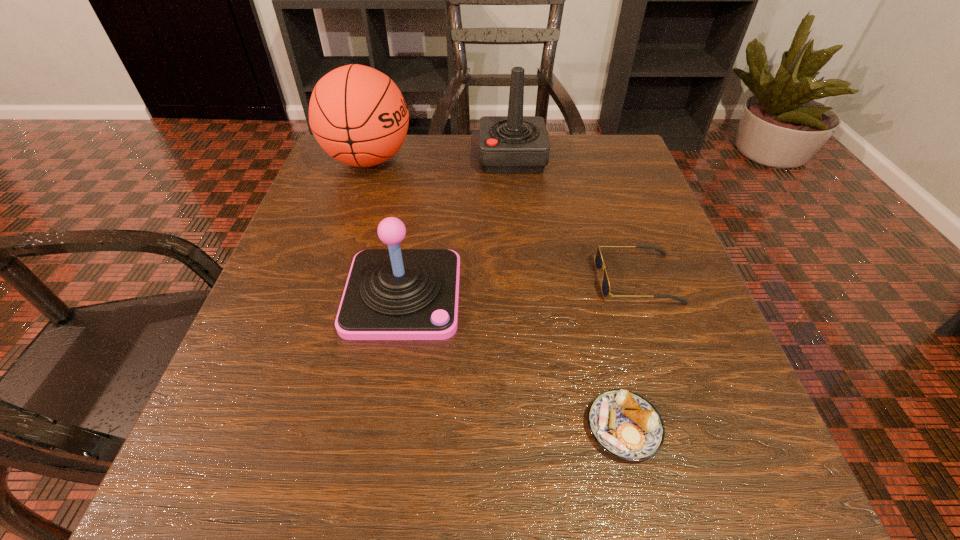
This screenshot has height=540, width=960. I want to click on free point between the second shortest object and the basketball, so click(503, 220).

Locate which object ranks second in proximity to the pastry. Please provide its 2D coordinates. Your answer should be formatted as a tuple, i.e. [(x, y)], where the tuple contains the x and y coordinates of a point satisfying the conditions above.

[(391, 294)]

Locate an element on the screen. object that is the third nearest to the shorter joystick is located at coordinates (598, 261).

Locate an element on the screen. The height and width of the screenshot is (540, 960). vacant region that satisfies the following two spatial constraints: 1. on the back side of the nearest object; 2. on the side with logo of the basketball is located at coordinates (561, 160).

What are the coordinates of `vacant space that satisfies the following two spatial constraints: 1. on the front-facing side of the nearest object; 2. on the right side of the right joystick` in the screenshot? It's located at (538, 427).

Locate an element on the screen. The height and width of the screenshot is (540, 960). free space that satisfies the following two spatial constraints: 1. on the front-facing side of the taller joystick; 2. on the right side of the shortest object is located at coordinates (538, 427).

Identify the location of vacant space that satisfies the following two spatial constraints: 1. on the front-facing side of the shortest object; 2. on the right side of the right joystick. The height and width of the screenshot is (540, 960). (538, 427).

This screenshot has height=540, width=960. In order to click on vacant space that satisfies the following two spatial constraints: 1. forward from the base of the nearer joystick; 2. on the right side of the pastry in this screenshot , I will do `click(381, 427)`.

You are a GUI agent. You are given a task and a screenshot of the screen. Output one action in this format:
    pyautogui.click(x=<x>, y=<y>)
    Task: Click on the vacant point that satisfies the following two spatial constraints: 1. on the front-facing side of the second shortest object; 2. forward from the base of the left joystick
    The height and width of the screenshot is (540, 960).
    Given the screenshot: What is the action you would take?
    [x=642, y=294]

Where is `vacant area in the image that satisfies the following two spatial constraints: 1. on the front-facing side of the sunglasses; 2. forward from the base of the shorter joystick`? vacant area in the image that satisfies the following two spatial constraints: 1. on the front-facing side of the sunglasses; 2. forward from the base of the shorter joystick is located at coordinates (642, 294).